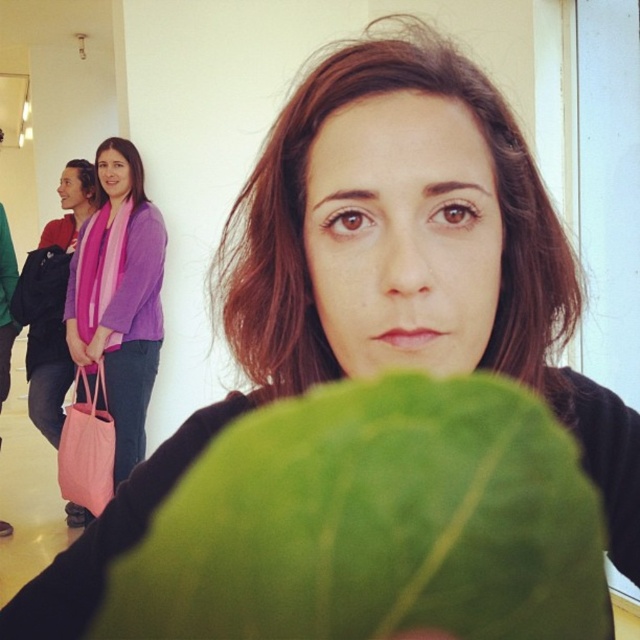
What are the coordinates of the green matte leaf at center in the image?

The green matte leaf at center is located at coordinates point (x=374, y=524).

You are a photographer trying to capture a clear shot of both the pink fabric scarf at upper left and the pink fabric bag at left. Which one is located more to the left side of the image?

The pink fabric bag at left is more to the left side of the image because the pink fabric scarf at upper left is positioned on the right side of it.

You are a photographer trying to capture a clear shot of the pink fabric bag at left without the green matte leaf at center blocking it. Based on their sizes, which object should you adjust your camera angle to focus on first?

The green matte leaf at center has a lesser height compared to the pink fabric bag at left, so you should adjust your camera angle to focus on the pink fabric bag at left first since it is taller and less likely to be obscured by the smaller leaf.